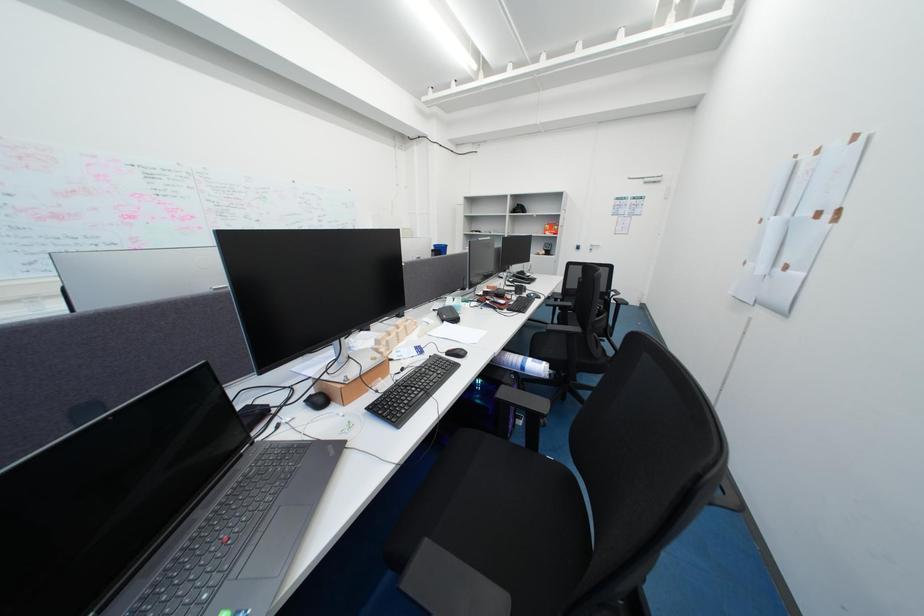
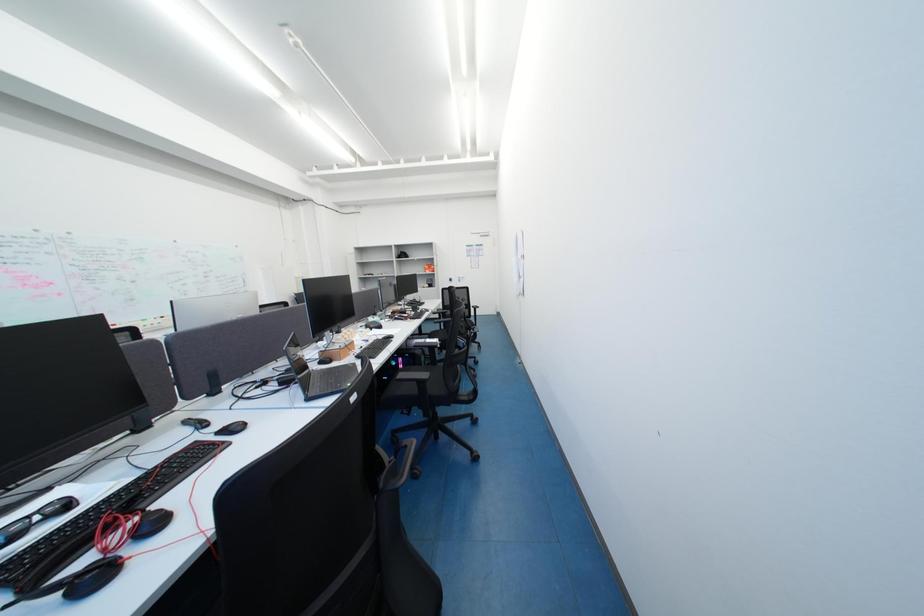
Question: Which direction would the cameraman need to move to produce the second image? Reply with the corresponding letter.

Choices:
 (A) Left
 (B) Right
 (C) Forward
 (D) Backward

Answer: (D)